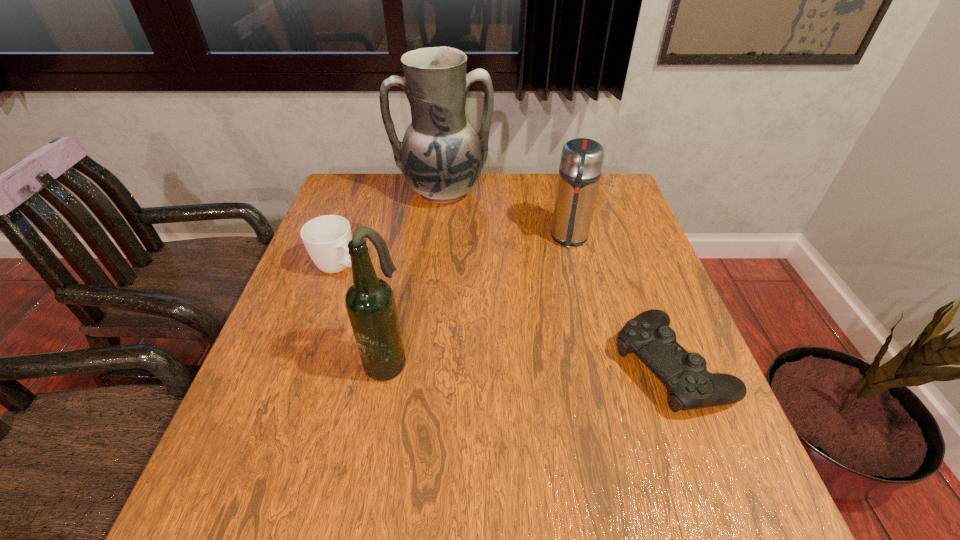
Locate which object is the second closest to the cup. Please provide its 2D coordinates. Your answer should be formatted as a tuple, i.e. [(x, y)], where the tuple contains the x and y coordinates of a point satisfying the conditions above.

[(370, 303)]

This screenshot has height=540, width=960. In order to click on vacant point that satisfies the following two spatial constraints: 1. on the back side of the thermos bottle; 2. on the right side of the fourth shortest object in this screenshot , I will do `click(409, 238)`.

This screenshot has width=960, height=540. Find the location of `vacant region that satisfies the following two spatial constraints: 1. on the back side of the tallest object; 2. on the left side of the second tallest object`. vacant region that satisfies the following two spatial constraints: 1. on the back side of the tallest object; 2. on the left side of the second tallest object is located at coordinates (418, 192).

At what (x,y) coordinates should I click in order to perform the action: click on vacant area in the image that satisfies the following two spatial constraints: 1. on the front side of the second tallest object; 2. on the left side of the second shortest object. Please return your answer as a coordinate pair (x, y). Looking at the image, I should click on click(308, 360).